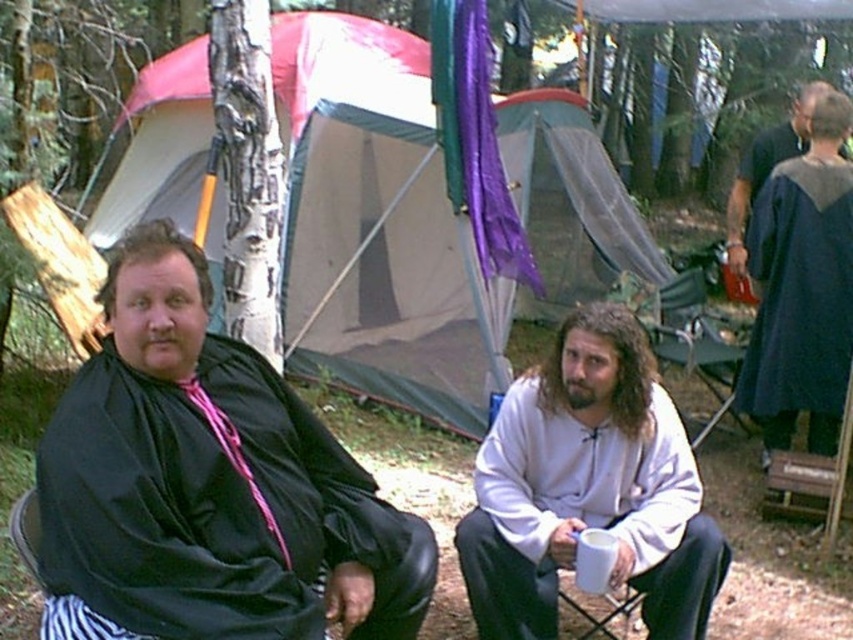
You are standing in the camping scene and want to know which of the two points, point (183, 481) or point (686, 346), is closer to you. Can you determine this based on the scene?

Point (183, 481) is closer to the camera than point (686, 346), so it is closer to you.

In the camping scene, there are two items of interest to a hiker planning to set up camp. The dark blue fabric robe at right and the metallic folding chair at center. Which of these two items is positioned closer to the right side of the image?

The dark blue fabric robe at right is positioned to the right of the metallic folding chair at center, so it is closer to the right side of the image.

You are a camper who needs to move a 2.5 meter long tent pole from the black matte robe at left to the metallic folding chair at center. Can you carry it horizontally without bending it? Explain your reasoning based on the distance between them.

The distance between the black matte robe at left and the metallic folding chair at center is 3.20 meters. Since the tent pole is 2.5 meters long, it can be carried horizontally between them as the distance is greater than the pole length, allowing space to maneuver without bending it.